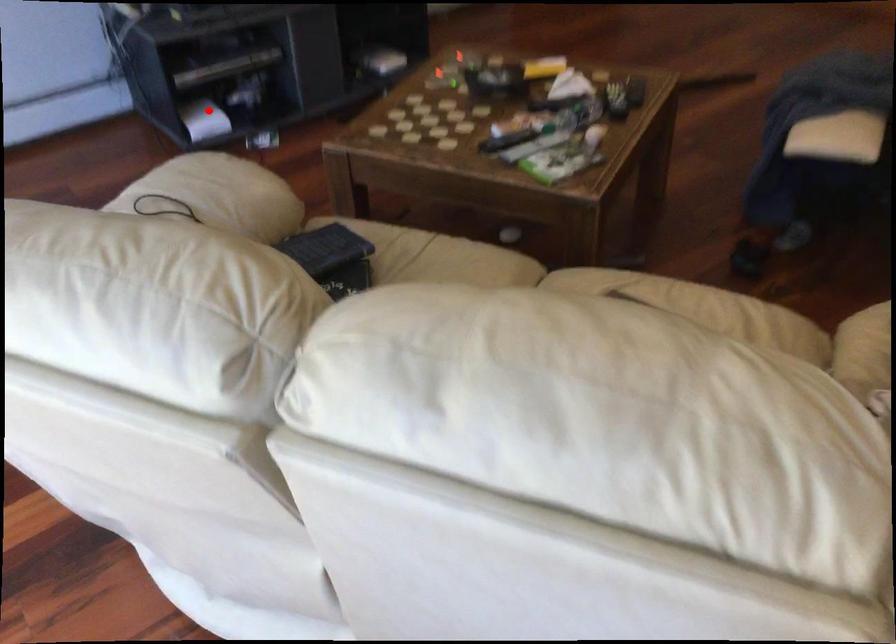
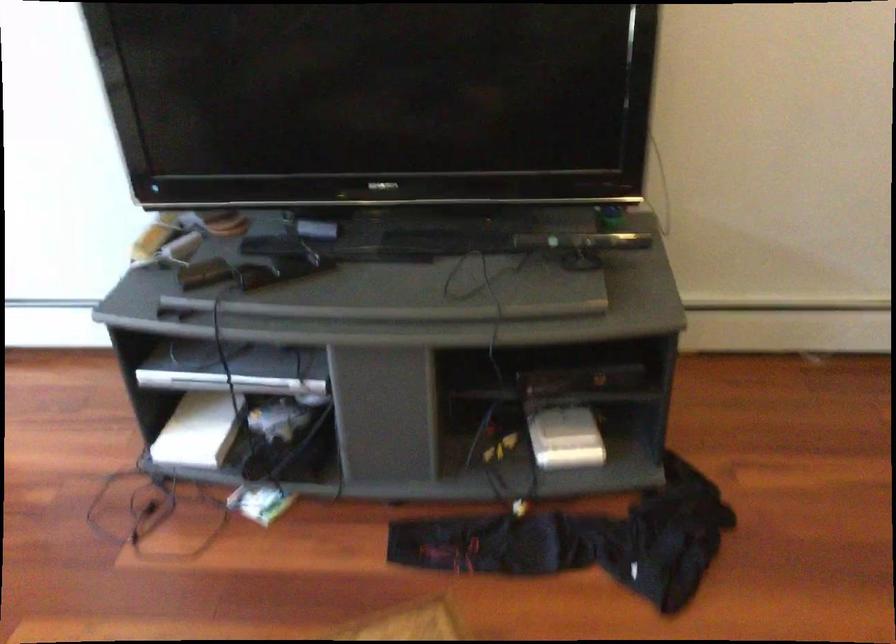
Question: I am providing you with two images of the same scene from different viewpoints. Image1 has a red point marked. In image2, the corresponding 3D location appears at what relative position? Reply with the corresponding letter.

Choices:
 (A) Closer
 (B) Farther

Answer: (A)